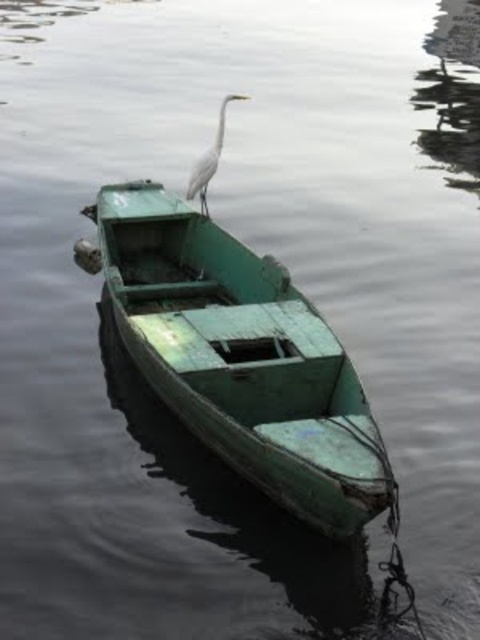
Question: Which point appears closest to the camera in this image?

Choices:
 (A) (213, 145)
 (B) (284, 276)

Answer: (B)

Question: Can you confirm if green weathered wood boat at center is bigger than white matte bird at upper center?

Choices:
 (A) yes
 (B) no

Answer: (B)

Question: Does green weathered wood boat at center appear on the left side of white matte bird at upper center?

Choices:
 (A) yes
 (B) no

Answer: (A)

Question: Is green weathered wood boat at center above white matte bird at upper center?

Choices:
 (A) yes
 (B) no

Answer: (B)